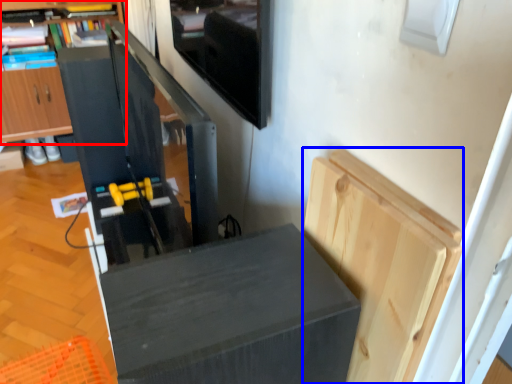
Question: Which point is further to the camera, cabinetry (highlighted by a red box) or cabinetry (highlighted by a blue box)?

Choices:
 (A) cabinetry
 (B) cabinetry

Answer: (A)